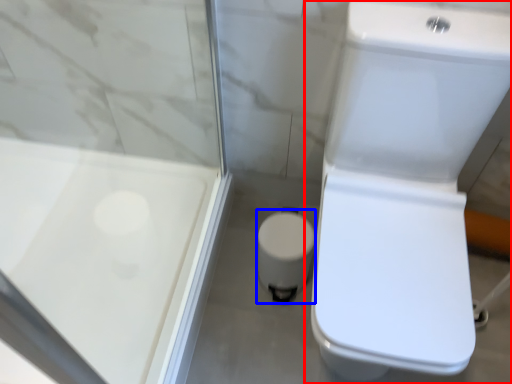
Question: Among these objects, which one is farthest to the camera, toilet (highlighted by a red box) or porcelain (highlighted by a blue box)?

Choices:
 (A) toilet
 (B) porcelain

Answer: (B)